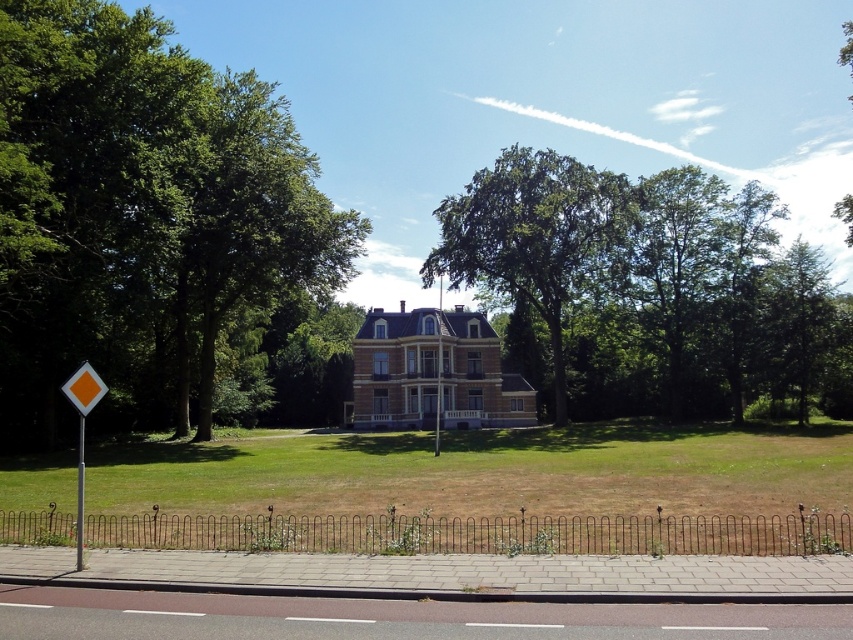
Consider the image. Is yellow plastic diamond at left shorter than orange plastic diamond at left?

In fact, yellow plastic diamond at left may be taller than orange plastic diamond at left.

Measure the distance between point (97,394) and camera.

Point (97,394) is 39.71 feet from camera.

The image size is (853, 640). In order to click on yellow plastic diamond at left in this screenshot , I will do `click(82, 432)`.

Which is below, green leafy tree at center or orange plastic diamond at left?

orange plastic diamond at left is below.

Is green leafy tree at center positioned at the back of orange plastic diamond at left?

Answer: Yes, green leafy tree at center is behind orange plastic diamond at left.

Which is behind, point (585, 182) or point (105, 388)?

The point (585, 182) is behind.

You are a GUI agent. You are given a task and a screenshot of the screen. Output one action in this format:
    pyautogui.click(x=<x>, y=<y>)
    Task: Click on the green leafy tree at center
    Image resolution: width=853 pixels, height=640 pixels.
    Given the screenshot: What is the action you would take?
    pyautogui.click(x=532, y=234)

This screenshot has width=853, height=640. What are the coordinates of `green leafy tree at center` in the screenshot? It's located at (532, 234).

This screenshot has width=853, height=640. What do you see at coordinates (532, 234) in the screenshot?
I see `green leafy tree at center` at bounding box center [532, 234].

Locate an element on the screen. green leafy tree at center is located at coordinates (532, 234).